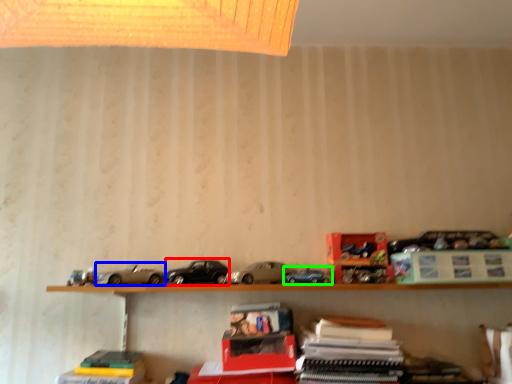
Question: Considering the real-world distances, which object is farthest from car (highlighted by a red box)? model car (highlighted by a blue box) or model car (highlighted by a green box)?

Choices:
 (A) model car
 (B) model car

Answer: (B)